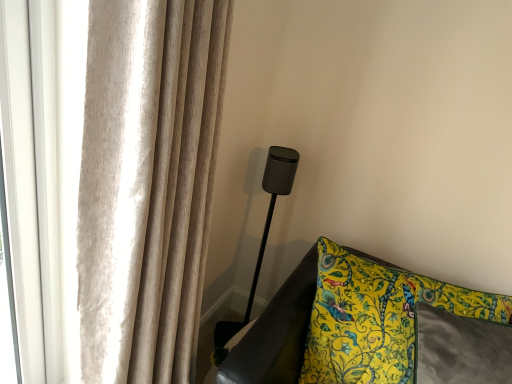
Question: Is beige textured curtain at upper left bigger than matte black speaker at center?

Choices:
 (A) no
 (B) yes

Answer: (B)

Question: Is beige textured curtain at upper left at the right side of matte black speaker at center?

Choices:
 (A) yes
 (B) no

Answer: (B)

Question: Is beige textured curtain at upper left taller than matte black speaker at center?

Choices:
 (A) no
 (B) yes

Answer: (B)

Question: Would you say matte black speaker at center is part of beige textured curtain at upper left's contents?

Choices:
 (A) no
 (B) yes

Answer: (A)

Question: Does beige textured curtain at upper left lie in front of matte black speaker at center?

Choices:
 (A) yes
 (B) no

Answer: (A)

Question: From a real-world perspective, is yellow floral fabric cushion at lower right positioned above or below matte black speaker at center?

Choices:
 (A) above
 (B) below

Answer: (B)

Question: Is yellow floral fabric cushion at lower right taller or shorter than matte black speaker at center?

Choices:
 (A) tall
 (B) short

Answer: (B)

Question: In terms of width, does yellow floral fabric cushion at lower right look wider or thinner when compared to matte black speaker at center?

Choices:
 (A) thin
 (B) wide

Answer: (B)

Question: Is point pos(238,375) positioned closer to the camera than point pos(260,251)?

Choices:
 (A) closer
 (B) farther

Answer: (A)

Question: Is yellow floral fabric cushion at lower right wider or thinner than beige textured curtain at upper left?

Choices:
 (A) wide
 (B) thin

Answer: (B)

Question: Is yellow floral fabric cushion at lower right situated inside beige textured curtain at upper left or outside?

Choices:
 (A) inside
 (B) outside

Answer: (B)

Question: From the image's perspective, is yellow floral fabric cushion at lower right located above or below beige textured curtain at upper left?

Choices:
 (A) above
 (B) below

Answer: (B)

Question: Considering the positions of yellow floral fabric cushion at lower right and beige textured curtain at upper left in the image, is yellow floral fabric cushion at lower right bigger or smaller than beige textured curtain at upper left?

Choices:
 (A) small
 (B) big

Answer: (A)

Question: From a real-world perspective, is matte black speaker at center physically located above or below beige textured curtain at upper left?

Choices:
 (A) above
 (B) below

Answer: (B)

Question: Looking at the image, does matte black speaker at center seem bigger or smaller compared to beige textured curtain at upper left?

Choices:
 (A) big
 (B) small

Answer: (B)